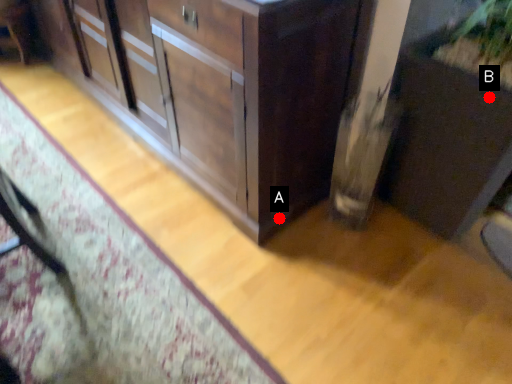
Question: Two points are circled on the image, labeled by A and B beside each circle. Which point is closer to the camera?

Choices:
 (A) A is closer
 (B) B is closer

Answer: (B)